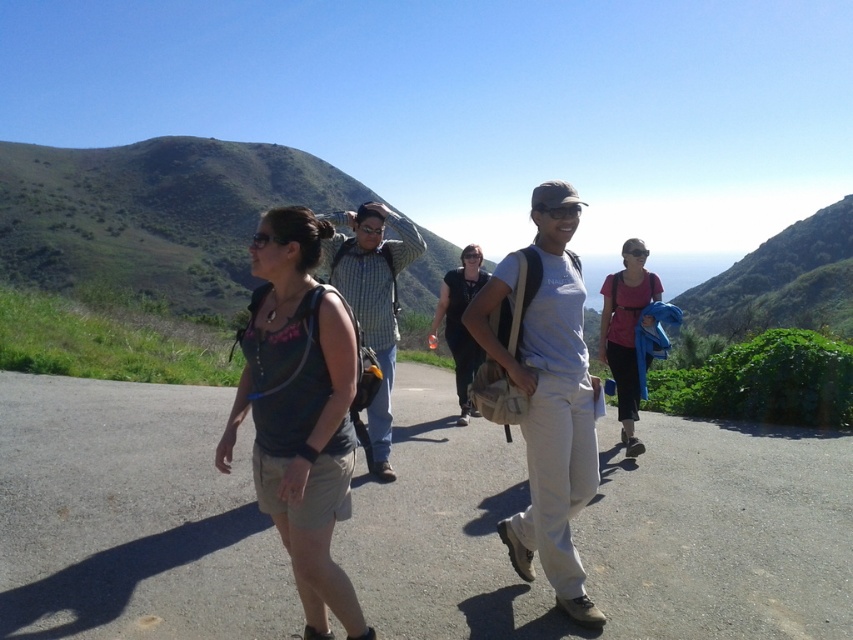
Question: Is white cotton shirt at center to the right of light gray cotton shirt at center from the viewer's perspective?

Choices:
 (A) yes
 (B) no

Answer: (A)

Question: Which is farther from the gray asphalt road at center?

Choices:
 (A) white cotton shirt at center
 (B) light gray cotton shirt at center

Answer: (B)

Question: Which point is farther from the camera taking this photo?

Choices:
 (A) (372, 305)
 (B) (445, 310)
 (C) (42, 467)

Answer: (B)

Question: Which object is farther from the camera taking this photo?

Choices:
 (A) white cotton shirt at center
 (B) light gray cotton shirt at center
 (C) plaid fabric shirt at center

Answer: (B)

Question: Is matte black tank top at center in front of plaid fabric shirt at center?

Choices:
 (A) no
 (B) yes

Answer: (B)

Question: Is gray asphalt road at center above matte pink shirt at center?

Choices:
 (A) no
 (B) yes

Answer: (A)